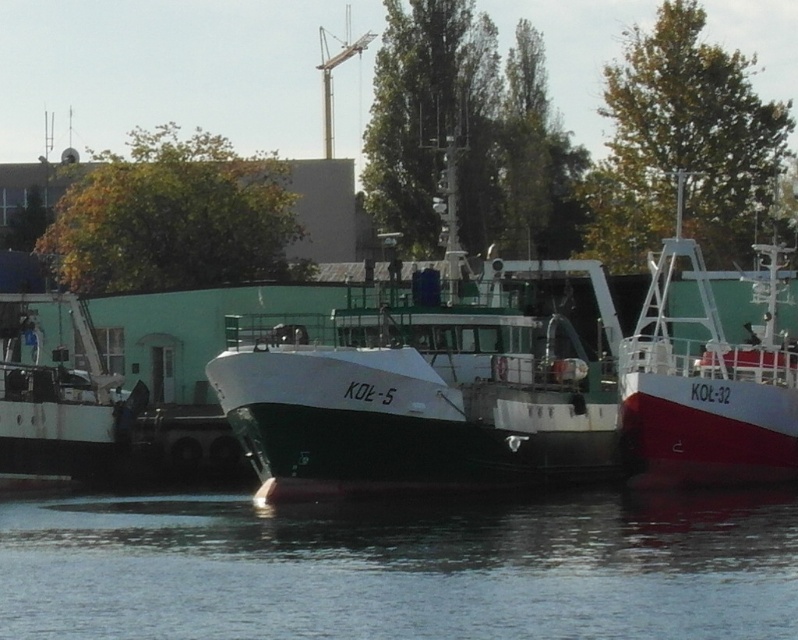
Question: Which of these objects is positioned closest to the green matte boat at center?

Choices:
 (A) red glossy boat at center
 (B) transparent water at center

Answer: (A)

Question: Does transparent water at center have a smaller size compared to red glossy boat at center?

Choices:
 (A) yes
 (B) no

Answer: (A)

Question: Among these points, which one is nearest to the camera?

Choices:
 (A) (346, 328)
 (B) (49, 564)

Answer: (B)

Question: Is the position of transparent water at center less distant than that of green matte boat at center?

Choices:
 (A) no
 (B) yes

Answer: (B)

Question: Does green matte boat at center have a greater width compared to red glossy boat at center?

Choices:
 (A) no
 (B) yes

Answer: (B)

Question: Which object appears farthest from the camera in this image?

Choices:
 (A) green matte boat at center
 (B) transparent water at center

Answer: (A)